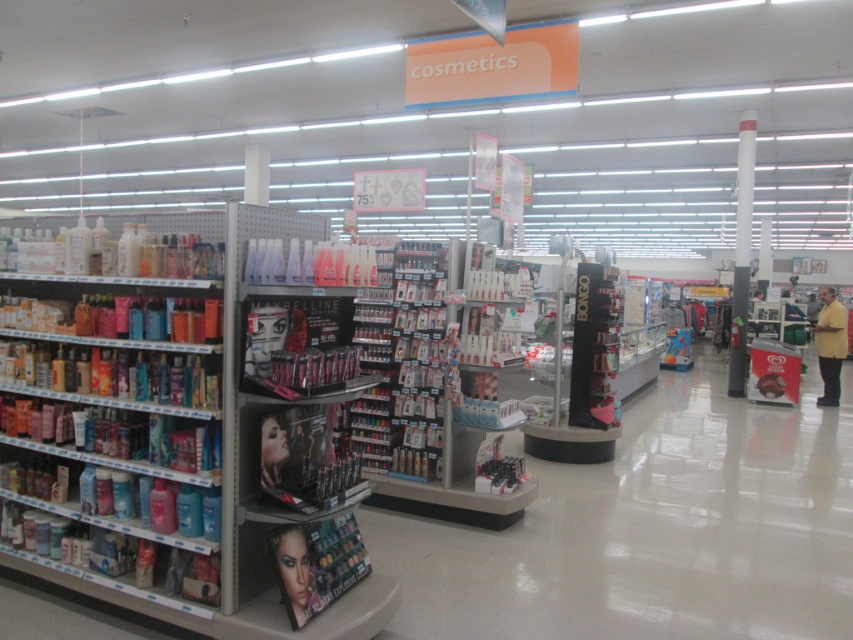
You are a customer in the cosmetics store and want to reach the two points marked in the image. Which point, point (740, 340) or point (844, 339), is closer to you?

Point (844, 339) is closer to you because it is in front of point (740, 340).